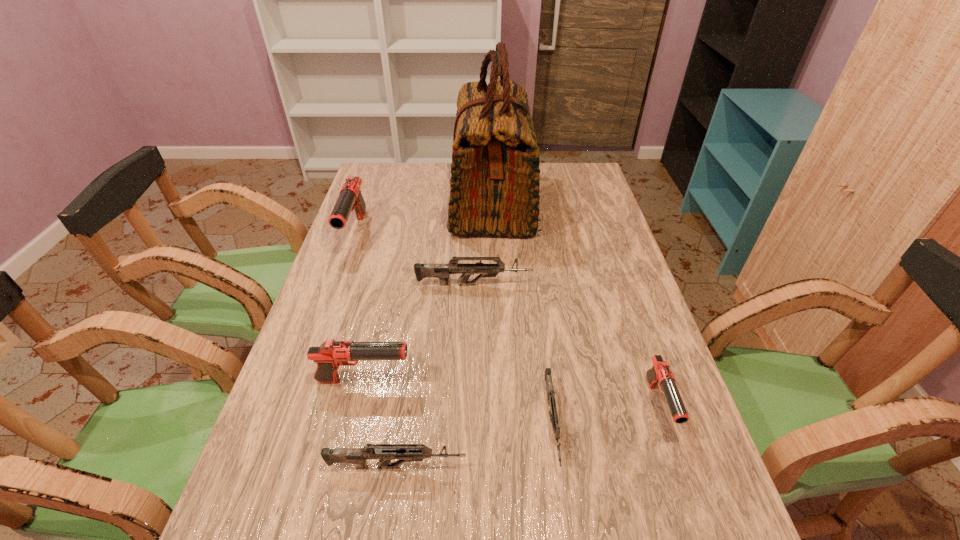
The image size is (960, 540). Identify the location of free region located aimed along the barrel of the sixth tallest object. (589, 466).

Locate an element on the screen. vacant space located 0.110m aimed along the barrel of the rightmost grey gun is located at coordinates (567, 538).

What are the coordinates of `object positioned at the far edge` in the screenshot? It's located at (494, 183).

This screenshot has height=540, width=960. In order to click on object positioned at the right edge in this screenshot , I will do `click(660, 373)`.

The height and width of the screenshot is (540, 960). In the image, there is a desktop. Identify the location of free region at the far edge. (446, 188).

The width and height of the screenshot is (960, 540). Identify the location of vacant region at the left edge of the desktop. (346, 229).

This screenshot has width=960, height=540. I want to click on vacant space at the right edge, so click(618, 278).

The width and height of the screenshot is (960, 540). I want to click on vacant area at the far right corner, so click(x=574, y=174).

Where is `free spot between the biggest black gun and the third tallest object`? The height and width of the screenshot is (540, 960). free spot between the biggest black gun and the third tallest object is located at coordinates (360, 307).

The width and height of the screenshot is (960, 540). In order to click on vacant space that is in between the sixth shortest object and the rightmost black gun in this screenshot , I will do `click(507, 320)`.